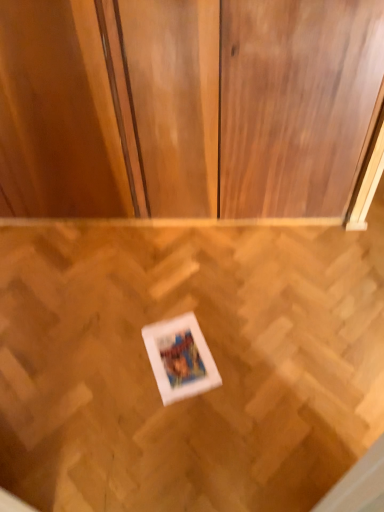
Where is `vacant area located to the right-hand side of matte wood dresser at center`? The image size is (384, 512). vacant area located to the right-hand side of matte wood dresser at center is located at coordinates (284, 251).